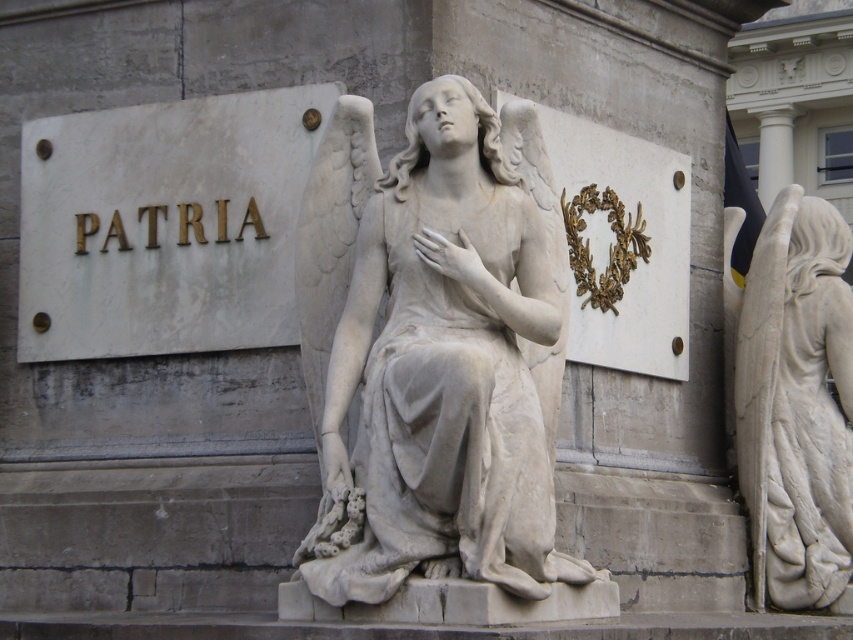
Consider the image. Between white marble statue at center and white marble statue at right, which one has more height?

white marble statue at right

Is point (521, 378) positioned in front of point (828, 221)?

Yes, it is.

In order to click on white marble statue at center in this screenshot , I will do `click(436, 349)`.

Is white marble statue at center in front of white marble sign at upper left?

Yes, white marble statue at center is in front of white marble sign at upper left.

Is point (425, 218) farther from camera compared to point (154, 230)?

That is False.

Who is more forward, (403, 467) or (106, 193)?

Point (403, 467) is in front.

This screenshot has width=853, height=640. Find the location of `white marble statue at center`. white marble statue at center is located at coordinates (436, 349).

Does white marble sign at upper left appear on the right side of white marble statue at right?

Incorrect, white marble sign at upper left is not on the right side of white marble statue at right.

What do you see at coordinates (164, 225) in the screenshot?
I see `white marble sign at upper left` at bounding box center [164, 225].

Locate an element on the screen. white marble sign at upper left is located at coordinates (164, 225).

This screenshot has height=640, width=853. In order to click on white marble sign at upper left in this screenshot , I will do `click(164, 225)`.